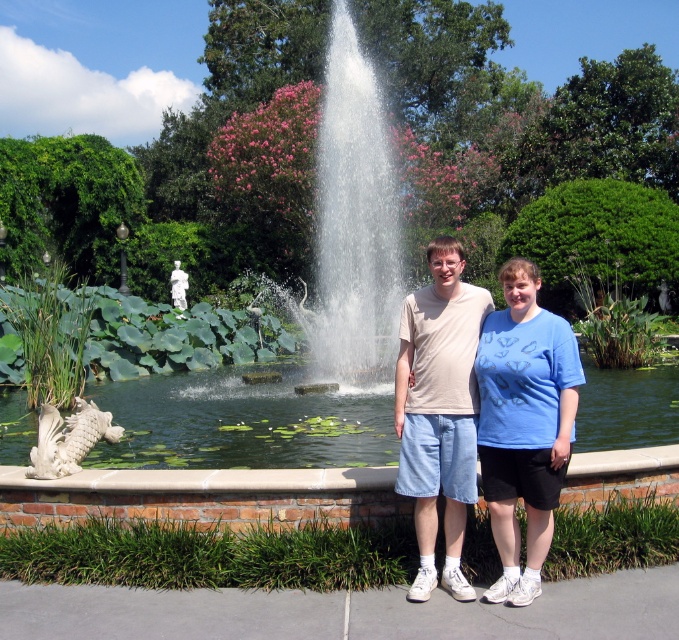
Question: Which point is farther from the camera taking this photo?

Choices:
 (A) (422, 349)
 (B) (238, 408)

Answer: (B)

Question: Does green leafy pond at center have a smaller size compared to matte beige t-shirt at center?

Choices:
 (A) yes
 (B) no

Answer: (B)

Question: Can you confirm if green leafy pond at center is positioned above matte beige t-shirt at center?

Choices:
 (A) yes
 (B) no

Answer: (B)

Question: Which object is closer to the camera taking this photo?

Choices:
 (A) matte beige t-shirt at center
 (B) green leafy pond at center

Answer: (A)

Question: Is green leafy pond at center above matte beige t-shirt at center?

Choices:
 (A) no
 (B) yes

Answer: (A)